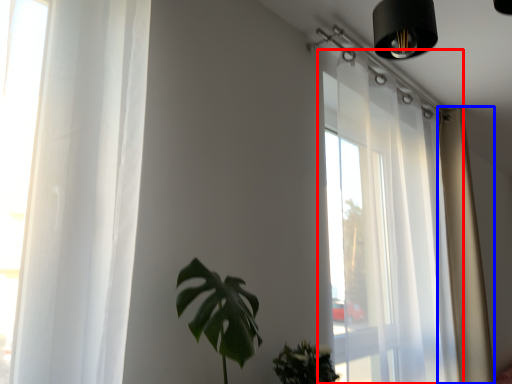
Question: Which object appears farthest to the camera in this image, window (highlighted by a red box) or curtain (highlighted by a blue box)?

Choices:
 (A) window
 (B) curtain

Answer: (B)